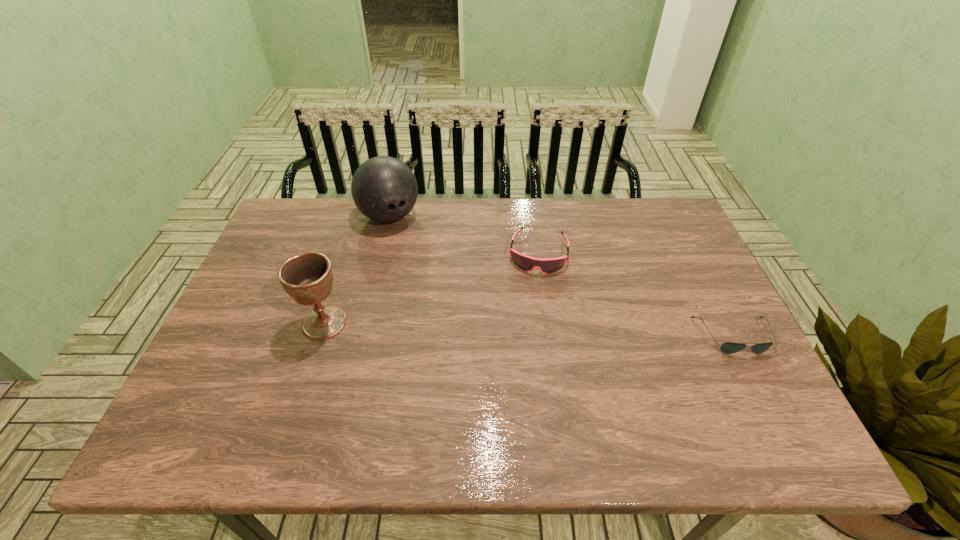
Identify the location of free point between the chalice and the shortest object. This screenshot has width=960, height=540. (529, 329).

Image resolution: width=960 pixels, height=540 pixels. What are the coordinates of `free space that is in between the goggles and the bowling ball` in the screenshot? It's located at pyautogui.click(x=464, y=235).

You are a GUI agent. You are given a task and a screenshot of the screen. Output one action in this format:
    pyautogui.click(x=<x>, y=<y>)
    Task: Click on the free space between the shortest object and the chalice
    
    Given the screenshot: What is the action you would take?
    pyautogui.click(x=529, y=329)

Choose which object is the nearest neighbor to the shortest object. Please provide its 2D coordinates. Your answer should be formatted as a tuple, i.e. [(x, y)], where the tuple contains the x and y coordinates of a point satisfying the conditions above.

[(549, 265)]

Where is `the closest object to the chalice`? This screenshot has width=960, height=540. the closest object to the chalice is located at coordinates (384, 189).

Identify the location of free spot that satisfies the following two spatial constraints: 1. on the back side of the second object from right to left; 2. on the left side of the chalice. (347, 253).